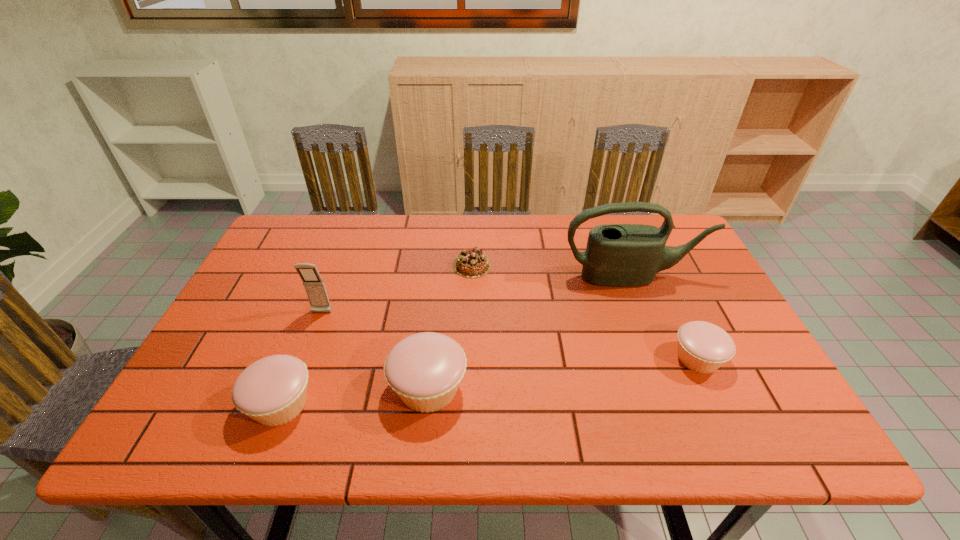
I want to click on the second shortest cupcake, so click(x=273, y=390).

Where is `the leftmost cupcake`? This screenshot has height=540, width=960. the leftmost cupcake is located at coordinates click(x=273, y=390).

Identify the location of the second cupcake from right to left. (425, 370).

This screenshot has width=960, height=540. What are the coordinates of `the shortest cupcake` in the screenshot? It's located at (703, 347).

The width and height of the screenshot is (960, 540). In order to click on the rightmost cupcake in this screenshot , I will do `click(703, 347)`.

Identify the location of chocolate cake. This screenshot has width=960, height=540. (473, 263).

What are the coordinates of `watering can` in the screenshot? It's located at (621, 255).

At what (x,y) coordinates should I click in order to perform the action: click on cellular telephone. Please return your answer as a coordinate pair (x, y). The image size is (960, 540). Looking at the image, I should click on (314, 286).

Where is `the fifth shortest object`? the fifth shortest object is located at coordinates (314, 286).

What are the coordinates of `free space located 0.110m on the left of the leftmost cupcake` in the screenshot? It's located at (195, 404).